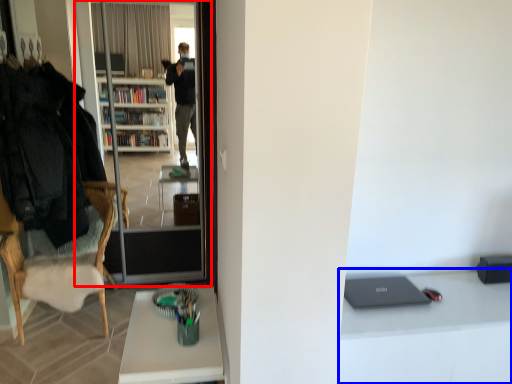
Question: Which object appears farthest to the camera in this image, screen door (highlighted by a red box) or computer desk (highlighted by a blue box)?

Choices:
 (A) screen door
 (B) computer desk

Answer: (A)